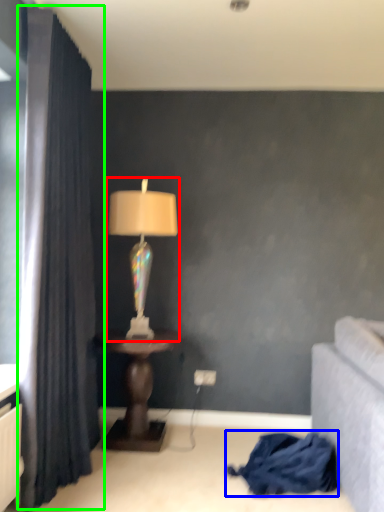
Question: Which is nearer to the lamp (highlighted by a red box)? blanket (highlighted by a blue box) or curtain (highlighted by a green box).

Choices:
 (A) blanket
 (B) curtain

Answer: (B)